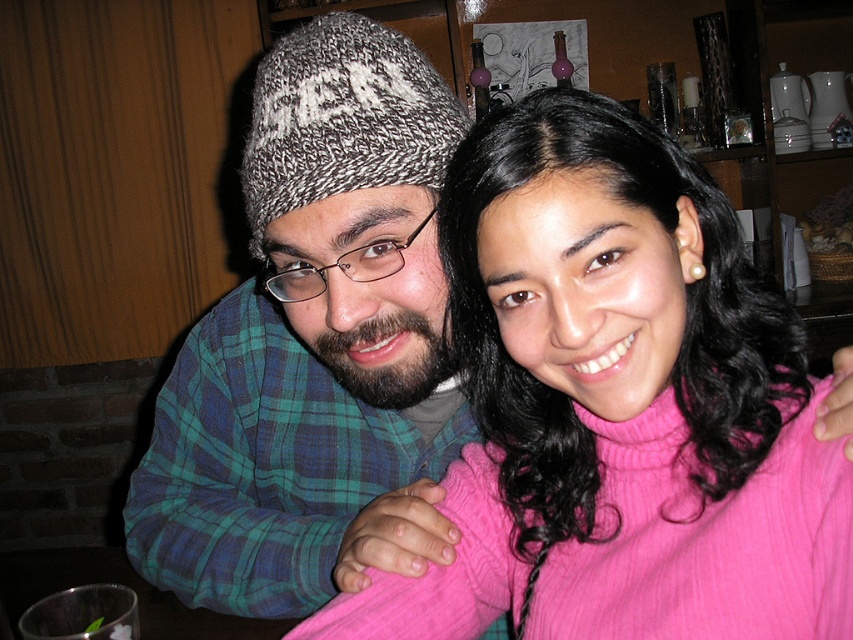
Does knitted wool beanie at upper left appear on the right side of knitted gray and white hat at upper left?

No, knitted wool beanie at upper left is not to the right of knitted gray and white hat at upper left.

In the scene shown: Which is more to the right, knitted wool beanie at upper left or knitted gray and white hat at upper left?

Positioned to the right is knitted gray and white hat at upper left.

Where is `knitted wool beanie at upper left`? Image resolution: width=853 pixels, height=640 pixels. knitted wool beanie at upper left is located at coordinates (310, 333).

At what (x,y) coordinates should I click in order to perform the action: click on knitted wool beanie at upper left. Please return your answer as a coordinate pair (x, y). The height and width of the screenshot is (640, 853). Looking at the image, I should click on (310, 333).